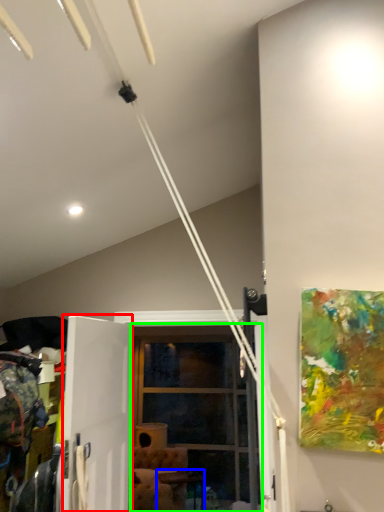
Question: Which is nearer to the screen door (highlighted by a red box)? table (highlighted by a blue box) or glass door (highlighted by a green box).

Choices:
 (A) table
 (B) glass door

Answer: (B)